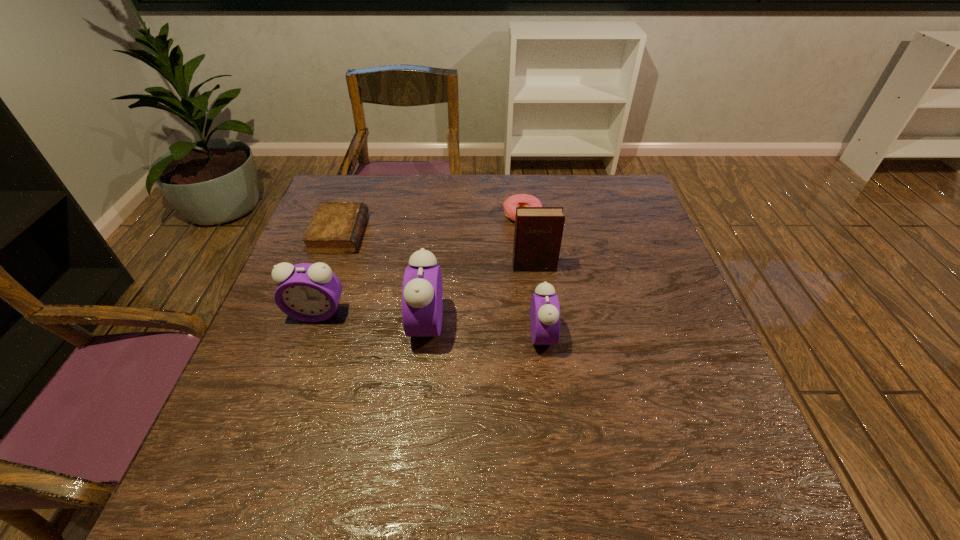
Identify the location of blank space located on the face of the second shortest alarm clock. (285, 401).

Identify the location of blank area located 0.190m on the face of the second alarm clock from left to right. (328, 324).

I want to click on vacant position located on the face of the second alarm clock from left to right, so click(306, 324).

Where is `vacant space located 0.340m on the face of the second alarm clock from left to right`? vacant space located 0.340m on the face of the second alarm clock from left to right is located at coordinates (262, 324).

The height and width of the screenshot is (540, 960). Find the location of `vacant space located on the face of the shortest alarm clock`. vacant space located on the face of the shortest alarm clock is located at coordinates (612, 335).

This screenshot has width=960, height=540. I want to click on free point located on the left of the doughnut, so [373, 214].

Find the location of a particular element. vacant space situated on the spine side of the farther diary is located at coordinates (474, 234).

Identify the location of vacant area located 0.340m on the front cover of the nearer diary. (550, 388).

Where is `doughnut situated at the far edge`? This screenshot has height=540, width=960. doughnut situated at the far edge is located at coordinates 518,200.

Where is `diary at the far edge`? The image size is (960, 540). diary at the far edge is located at coordinates (336, 227).